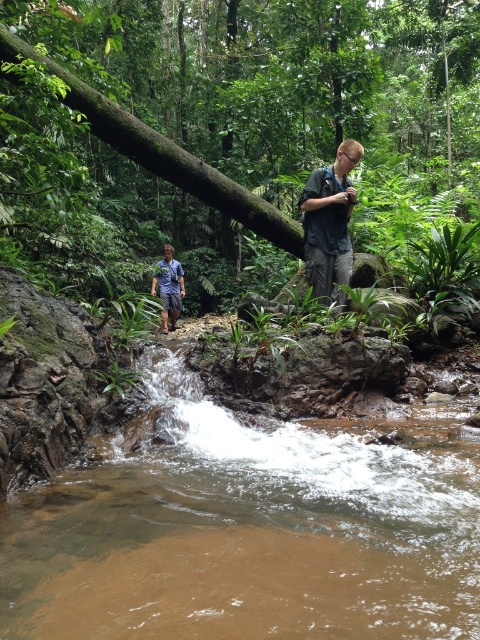
Can you confirm if brown muddy stream at lower center is bigger than green rough tree trunk at upper center?

No.

Is brown muddy stream at lower center behind green rough tree trunk at upper center?

No, it is in front of green rough tree trunk at upper center.

Which is in front, point (302, 544) or point (134, 147)?

Positioned in front is point (302, 544).

Where is `brown muddy stream at lower center`? This screenshot has height=640, width=480. brown muddy stream at lower center is located at coordinates (244, 536).

Is point (418, 470) farther from camera compared to point (349, 272)?

No, (418, 470) is closer to viewer.

This screenshot has height=640, width=480. What do you see at coordinates (244, 536) in the screenshot?
I see `brown muddy stream at lower center` at bounding box center [244, 536].

At what (x,y) coordinates should I click in order to perform the action: click on brown muddy stream at lower center. Please return your answer as a coordinate pair (x, y). Looking at the image, I should click on (244, 536).

Is green rough log at upper center to the left of green rough tree trunk at upper center from the viewer's perspective?

No, green rough log at upper center is not to the left of green rough tree trunk at upper center.

Can you confirm if green rough log at upper center is positioned to the right of green rough tree trunk at upper center?

Correct, you'll find green rough log at upper center to the right of green rough tree trunk at upper center.

Measure the distance between point (463, 4) and camera.

Point (463, 4) is 20.86 meters from camera.

This screenshot has width=480, height=640. In order to click on green rough log at upper center in this screenshot , I will do pos(229,131).